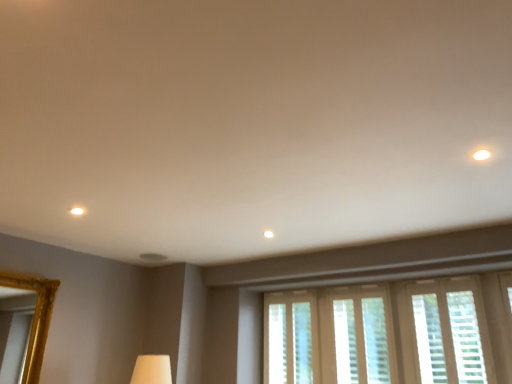
Consider the image. Measure the distance between white textured blinds at lower right, the first window positioned from the right, and camera.

A distance of 9.37 feet exists between white textured blinds at lower right, the first window positioned from the right, and camera.

Where is `translucent plastic blinds at center, which appears as the third window when viewed from the right`? translucent plastic blinds at center, which appears as the third window when viewed from the right is located at coordinates (290, 338).

From the picture: Which object is thinner, white textured blinds at lower right, the first window positioned from the right, or translucent plastic blinds at lower center, which appears as the 2th window when viewed from the left?

translucent plastic blinds at lower center, which appears as the 2th window when viewed from the left.

Is white textured blinds at lower right, the first window positioned from the right, facing away from translucent plastic blinds at lower center, the second window viewed from the right?

No, white textured blinds at lower right, the first window positioned from the right, is not facing the opposite direction of translucent plastic blinds at lower center, the second window viewed from the right.

Is white textured blinds at lower right, the 3th window positioned from the left, not close to translucent plastic blinds at lower center, the second window viewed from the right?

No, white textured blinds at lower right, the 3th window positioned from the left, is not far away from translucent plastic blinds at lower center, the second window viewed from the right.

In the scene shown: Can you confirm if white textured blinds at lower right, the 3th window positioned from the left, is shorter than translucent plastic blinds at lower center, which appears as the 2th window when viewed from the left?

Indeed, white textured blinds at lower right, the 3th window positioned from the left, has a lesser height compared to translucent plastic blinds at lower center, which appears as the 2th window when viewed from the left.

Which is more to the right, translucent plastic blinds at lower center, which appears as the 2th window when viewed from the left, or translucent plastic blinds at center, marked as the 1th window in a left-to-right arrangement?

translucent plastic blinds at lower center, which appears as the 2th window when viewed from the left.

This screenshot has width=512, height=384. In the image, there is a translucent plastic blinds at lower center, which appears as the 2th window when viewed from the left. What are the coordinates of `window below it (from a real-world perspective)` in the screenshot? It's located at (290, 338).

From the image's perspective, which one is positioned lower, translucent plastic blinds at lower center, the second window viewed from the right, or translucent plastic blinds at center, which appears as the third window when viewed from the right?

translucent plastic blinds at center, which appears as the third window when viewed from the right, is shown below in the image.

Is translucent plastic blinds at center, marked as the 1th window in a left-to-right arrangement, positioned in front of white textured blinds at lower right, the 3th window positioned from the left?

No, translucent plastic blinds at center, marked as the 1th window in a left-to-right arrangement, is further to the viewer.

There is a translucent plastic blinds at center, marked as the 1th window in a left-to-right arrangement. At what (x,y) coordinates should I click in order to perform the action: click on the 2nd window above it (from the image's perspective). Please return your answer as a coordinate pair (x, y). This screenshot has width=512, height=384. Looking at the image, I should click on (450, 331).

Who is smaller, translucent plastic blinds at center, marked as the 1th window in a left-to-right arrangement, or white textured blinds at lower right, the 3th window positioned from the left?

white textured blinds at lower right, the 3th window positioned from the left.

From the image's perspective, between translucent plastic blinds at center, marked as the 1th window in a left-to-right arrangement, and white textured blinds at lower right, the first window positioned from the right, who is located below?

translucent plastic blinds at center, marked as the 1th window in a left-to-right arrangement, appears lower in the image.

Consider the image. Is translucent plastic blinds at center, marked as the 1th window in a left-to-right arrangement, smaller than translucent plastic blinds at lower center, the second window viewed from the right?

No, translucent plastic blinds at center, marked as the 1th window in a left-to-right arrangement, is not smaller than translucent plastic blinds at lower center, the second window viewed from the right.

From the picture: From the image's perspective, is translucent plastic blinds at center, marked as the 1th window in a left-to-right arrangement, on top of translucent plastic blinds at lower center, the second window viewed from the right?

No.

What's the angular difference between translucent plastic blinds at center, marked as the 1th window in a left-to-right arrangement, and translucent plastic blinds at lower center, the second window viewed from the right,'s facing directions?

The facing directions of translucent plastic blinds at center, marked as the 1th window in a left-to-right arrangement, and translucent plastic blinds at lower center, the second window viewed from the right, are 0.846 degrees apart.

Does point (311, 320) come behind point (376, 351)?

Yes, point (311, 320) is behind point (376, 351).

Does translucent plastic blinds at lower center, the second window viewed from the right, have a lesser width compared to white textured blinds at lower right, the 3th window positioned from the left?

Yes.

From a real-world perspective, who is located lower, translucent plastic blinds at lower center, the second window viewed from the right, or white textured blinds at lower right, the 3th window positioned from the left?

translucent plastic blinds at lower center, the second window viewed from the right.

Could you tell me if translucent plastic blinds at lower center, the second window viewed from the right, is turned towards white textured blinds at lower right, the 3th window positioned from the left?

No, translucent plastic blinds at lower center, the second window viewed from the right, is not aimed at white textured blinds at lower right, the 3th window positioned from the left.

Does point (371, 304) come farther from viewer compared to point (461, 290)?

Yes, point (371, 304) is behind point (461, 290).

Is white textured blinds at lower right, the 3th window positioned from the left, aimed at translucent plastic blinds at center, which appears as the third window when viewed from the right?

No.

Where is `the 2nd window above when counting from the translucent plastic blinds at center, marked as the 1th window in a left-to-right arrangement (from the image's perspective)`? The width and height of the screenshot is (512, 384). the 2nd window above when counting from the translucent plastic blinds at center, marked as the 1th window in a left-to-right arrangement (from the image's perspective) is located at coordinates (450, 331).

How far apart are white textured blinds at lower right, the first window positioned from the right, and translucent plastic blinds at center, which appears as the third window when viewed from the right?

white textured blinds at lower right, the first window positioned from the right, is 3.60 feet from translucent plastic blinds at center, which appears as the third window when viewed from the right.

Does white textured blinds at lower right, the first window positioned from the right, have a lesser width compared to translucent plastic blinds at center, marked as the 1th window in a left-to-right arrangement?

Indeed, white textured blinds at lower right, the first window positioned from the right, has a lesser width compared to translucent plastic blinds at center, marked as the 1th window in a left-to-right arrangement.

Image resolution: width=512 pixels, height=384 pixels. Find the location of `the 1st window to the left when counting from the white textured blinds at lower right, the 3th window positioned from the left`. the 1st window to the left when counting from the white textured blinds at lower right, the 3th window positioned from the left is located at coordinates (362, 335).

Locate an element on the screen. The width and height of the screenshot is (512, 384). window that appears below the translucent plastic blinds at lower center, which appears as the 2th window when viewed from the left (from the image's perspective) is located at coordinates (290, 338).

Considering their positions, is translucent plastic blinds at lower center, which appears as the 2th window when viewed from the left, positioned closer to translucent plastic blinds at center, which appears as the third window when viewed from the right, than white textured blinds at lower right, the first window positioned from the right?

translucent plastic blinds at lower center, which appears as the 2th window when viewed from the left, is closer to translucent plastic blinds at center, which appears as the third window when viewed from the right.

Which object lies further to the anchor point translucent plastic blinds at center, which appears as the third window when viewed from the right, white textured blinds at lower right, the first window positioned from the right, or translucent plastic blinds at lower center, which appears as the 2th window when viewed from the left?

Among the two, white textured blinds at lower right, the first window positioned from the right, is located further to translucent plastic blinds at center, which appears as the third window when viewed from the right.

Which object lies nearer to the anchor point white textured blinds at lower right, the 3th window positioned from the left, translucent plastic blinds at center, which appears as the third window when viewed from the right, or translucent plastic blinds at lower center, which appears as the 2th window when viewed from the left?

Among the two, translucent plastic blinds at lower center, which appears as the 2th window when viewed from the left, is located nearer to white textured blinds at lower right, the 3th window positioned from the left.

Looking at the image, which one is located further to white textured blinds at lower right, the 3th window positioned from the left, translucent plastic blinds at lower center, which appears as the 2th window when viewed from the left, or translucent plastic blinds at center, marked as the 1th window in a left-to-right arrangement?

Based on the image, translucent plastic blinds at center, marked as the 1th window in a left-to-right arrangement, appears to be further to white textured blinds at lower right, the 3th window positioned from the left.

From the image, which object appears to be nearer to translucent plastic blinds at lower center, the second window viewed from the right, white textured blinds at lower right, the 3th window positioned from the left, or translucent plastic blinds at center, marked as the 1th window in a left-to-right arrangement?

white textured blinds at lower right, the 3th window positioned from the left, lies closer to translucent plastic blinds at lower center, the second window viewed from the right, than the other object.

Which object lies further to the anchor point translucent plastic blinds at lower center, the second window viewed from the right, translucent plastic blinds at center, which appears as the third window when viewed from the right, or white textured blinds at lower right, the 3th window positioned from the left?

translucent plastic blinds at center, which appears as the third window when viewed from the right.

Locate an element on the screen. This screenshot has height=384, width=512. window between translucent plastic blinds at center, which appears as the third window when viewed from the right, and white textured blinds at lower right, the 3th window positioned from the left, from left to right is located at coordinates coord(362,335).